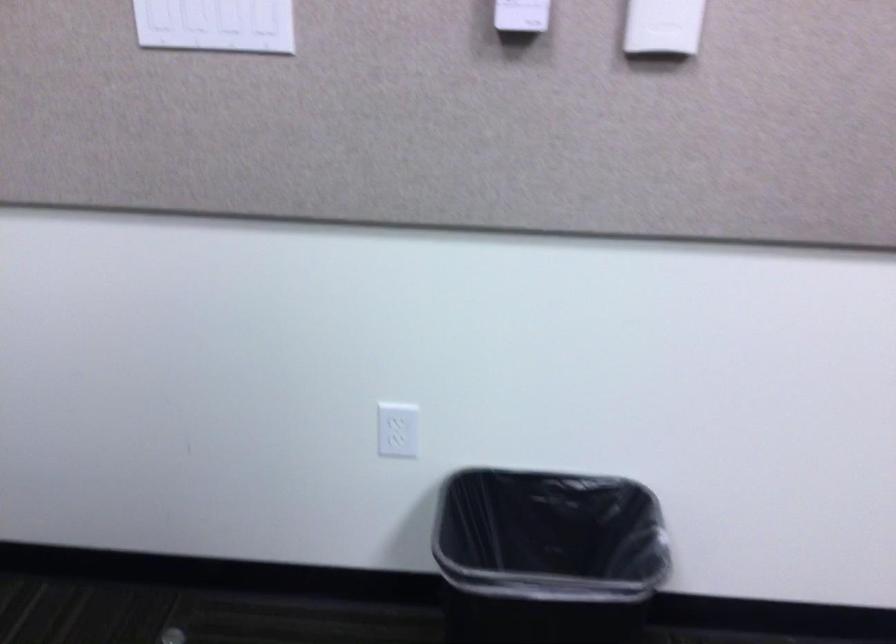
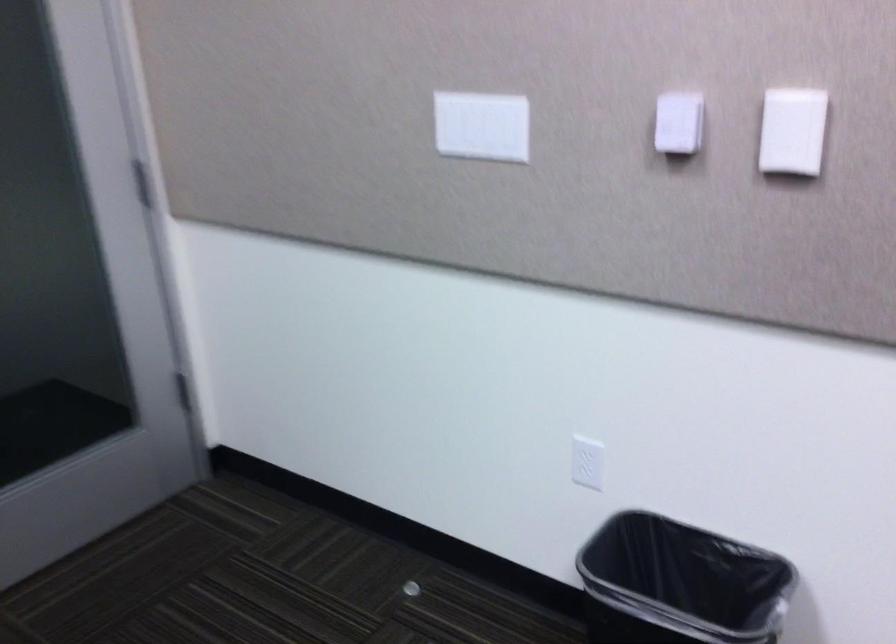
Where in the second image is the point corresponding to (x=521, y=538) from the first image?

(679, 583)